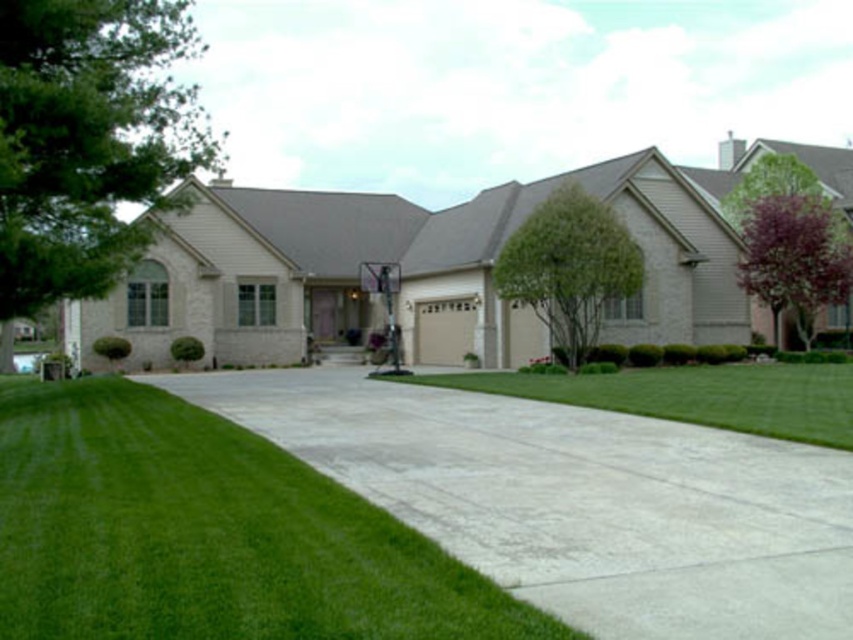
You are a gardener planning to mow the lawn. You see the green grass at center and the green leafy tree at center. Which one should you mow first based on their height?

The green grass at center is taller than the green leafy tree at center, so you should mow the green grass at center first.

You are standing at the front door of the suburban house and want to walk to the basketball hoop in the driveway. Which tree should you pass first, the green leafy tree at upper left or the purple leafy tree at right?

Since the green leafy tree at upper left is to the left of the purple leafy tree at right, you would pass the green leafy tree at upper left first when moving from the front door towards the driveway where the basketball hoop is located.